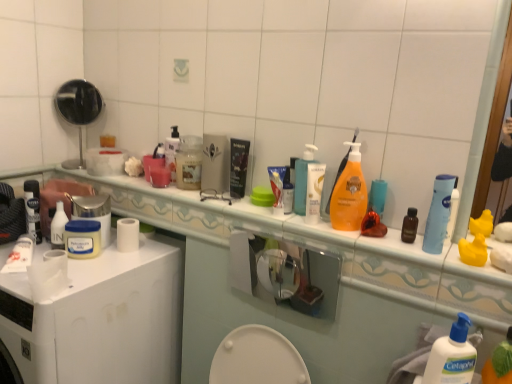
Where is `free space above white glossy counter top at upper center (from a real-world perspective)`? Image resolution: width=512 pixels, height=384 pixels. free space above white glossy counter top at upper center (from a real-world perspective) is located at coordinates (258, 209).